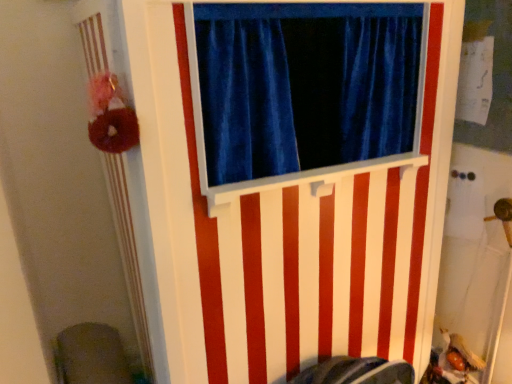
Question: Is velvet gray swivel chair at lower left completely or partially outside of white striped barn door at center?

Choices:
 (A) no
 (B) yes

Answer: (B)

Question: From a real-world perspective, is velvet gray swivel chair at lower left on white striped barn door at center?

Choices:
 (A) no
 (B) yes

Answer: (A)

Question: From the image's perspective, is velvet gray swivel chair at lower left over white striped barn door at center?

Choices:
 (A) yes
 (B) no

Answer: (B)

Question: Does velvet gray swivel chair at lower left have a smaller size compared to white striped barn door at center?

Choices:
 (A) yes
 (B) no

Answer: (A)

Question: From a real-world perspective, is velvet gray swivel chair at lower left located beneath white striped barn door at center?

Choices:
 (A) no
 (B) yes

Answer: (B)

Question: Does velvet gray swivel chair at lower left have a lesser width compared to white striped barn door at center?

Choices:
 (A) no
 (B) yes

Answer: (B)

Question: Does white striped barn door at center lie in front of velvet gray swivel chair at lower left?

Choices:
 (A) yes
 (B) no

Answer: (A)

Question: Is white striped barn door at center turned away from velvet gray swivel chair at lower left?

Choices:
 (A) yes
 (B) no

Answer: (B)

Question: Is white striped barn door at center touching velvet gray swivel chair at lower left?

Choices:
 (A) yes
 (B) no

Answer: (B)

Question: Does white striped barn door at center turn towards velvet gray swivel chair at lower left?

Choices:
 (A) no
 (B) yes

Answer: (A)

Question: Does white striped barn door at center appear on the left side of velvet gray swivel chair at lower left?

Choices:
 (A) no
 (B) yes

Answer: (A)

Question: Is white striped barn door at center at the right side of velvet gray swivel chair at lower left?

Choices:
 (A) no
 (B) yes

Answer: (B)

Question: Considering the positions of white striped barn door at center and velvet gray swivel chair at lower left in the image, is white striped barn door at center wider or thinner than velvet gray swivel chair at lower left?

Choices:
 (A) thin
 (B) wide

Answer: (B)